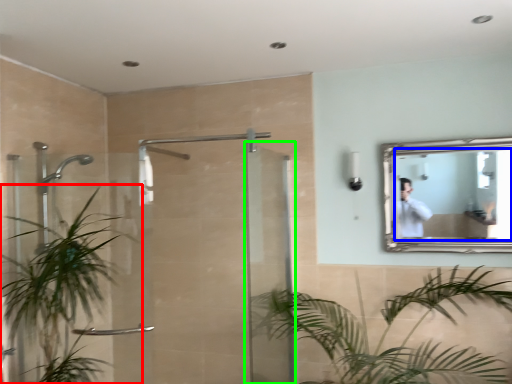
Question: Estimate the real-world distances between objects in this image. Which object is closer to houseplant (highlighted by a red box), mirror (highlighted by a blue box) or screen door (highlighted by a green box)?

Choices:
 (A) mirror
 (B) screen door

Answer: (B)